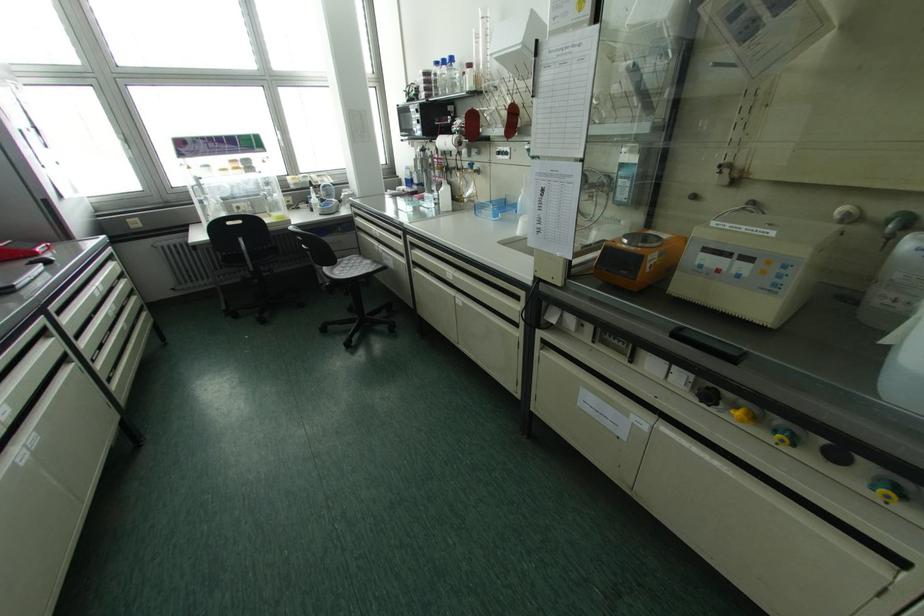
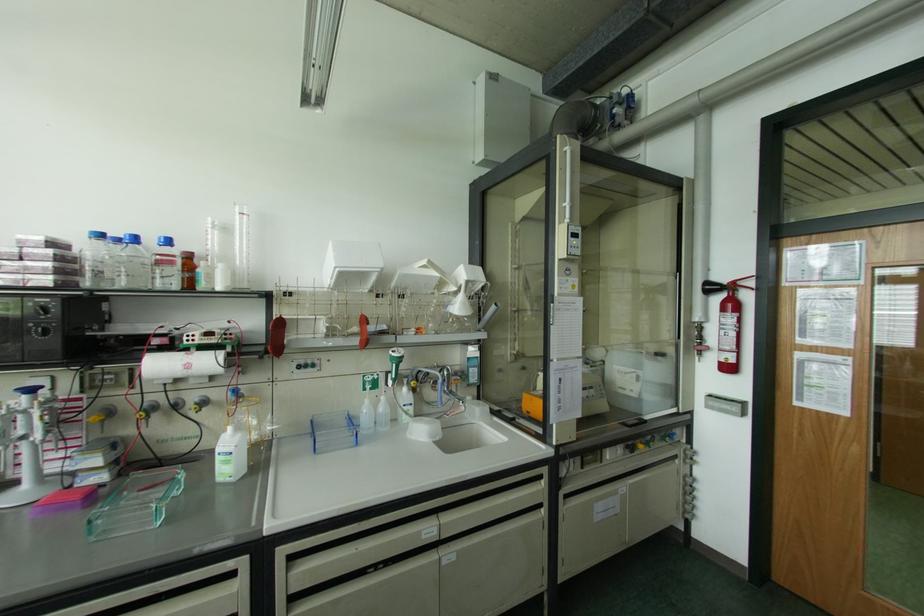
Where in the second image is the point corresponding to point (451, 59) from the first image?

(167, 241)